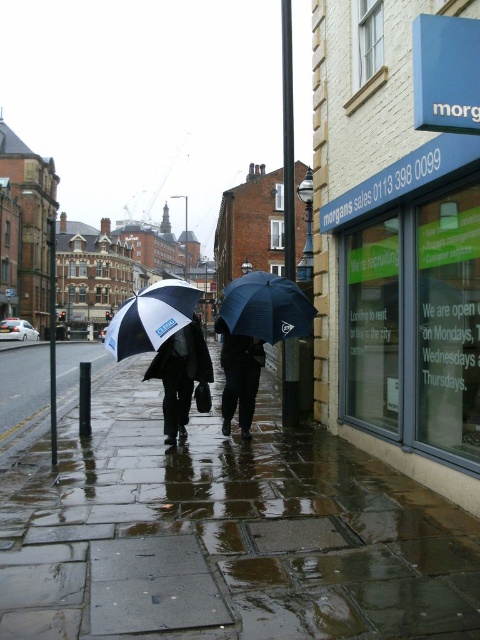
Question: Based on their relative distances, which object is nearer to the wet stone pavement at lower center?

Choices:
 (A) blue glass storefront at center right
 (B) dark blue fabric umbrella at center

Answer: (B)

Question: Can you confirm if wet stone pavement at lower center is bigger than white and black umbrella at center?

Choices:
 (A) yes
 (B) no

Answer: (B)

Question: Can you confirm if wet stone pavement at lower center is wider than blue glass storefront at center right?

Choices:
 (A) yes
 (B) no

Answer: (B)

Question: Does black matte umbrella at center appear on the right side of dark blue fabric umbrella at center?

Choices:
 (A) yes
 (B) no

Answer: (B)

Question: Which object appears farthest from the camera in this image?

Choices:
 (A) white and black umbrella at center
 (B) black matte umbrella at center
 (C) blue glass storefront at center right
 (D) dark blue matte umbrella at center

Answer: (D)

Question: Which point is closer to the camera taking this photo?

Choices:
 (A) (197, 513)
 (B) (406, 170)
 (C) (301, 307)
 (D) (118, 316)

Answer: (A)